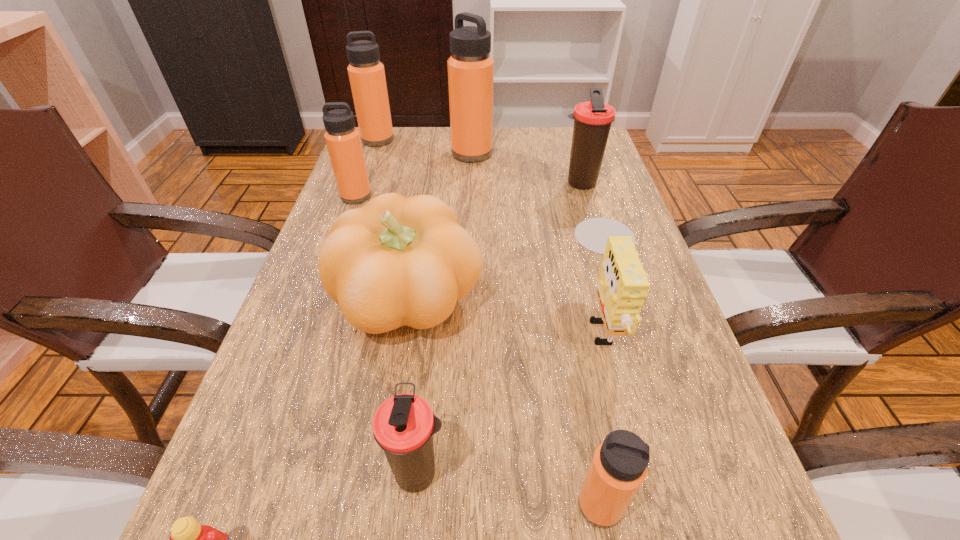
At what (x,y) coordinates should I click in order to perform the action: click on vacant space located 0.350m on the front-facing side of the sponge. Please return your answer as a coordinate pair (x, y). Looking at the image, I should click on (388, 316).

Image resolution: width=960 pixels, height=540 pixels. Find the location of `free space located on the left of the nearer brown thermos bottle`. free space located on the left of the nearer brown thermos bottle is located at coordinates coord(228,471).

Locate an element on the screen. free spot located 0.360m on the left of the smallest orange thermos bottle is located at coordinates click(x=310, y=505).

Locate an element on the screen. pumpkin that is at the left edge is located at coordinates (397, 261).

Locate an element on the screen. This screenshot has height=540, width=960. thermos bottle located at the right edge is located at coordinates (592, 120).

At what (x,y) coordinates should I click in order to perform the action: click on sponge situated at the right edge. Please return your answer as a coordinate pair (x, y). The width and height of the screenshot is (960, 540). Looking at the image, I should click on (623, 286).

Find the location of a particular element. object that is at the far left corner is located at coordinates (366, 73).

Locate an element on the screen. This screenshot has height=540, width=960. blank space at the far edge is located at coordinates (433, 139).

Image resolution: width=960 pixels, height=540 pixels. In the image, there is a desktop. What are the coordinates of `vacant space at the left edge` in the screenshot? It's located at (338, 333).

Where is `free spot at the right edge of the desktop`? Image resolution: width=960 pixels, height=540 pixels. free spot at the right edge of the desktop is located at coordinates (642, 243).